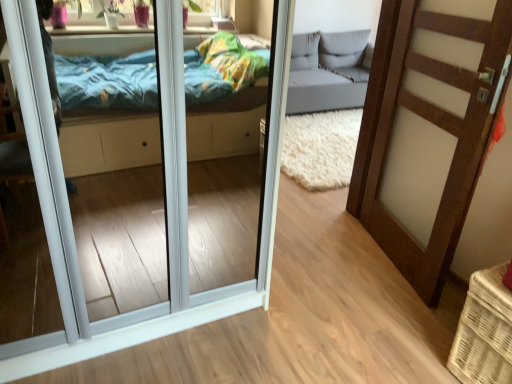
Question: Is brown wood door at right, placed as the 1th door when sorted from right to left, to the left or to the right of white wicker basket at lower right in the image?

Choices:
 (A) right
 (B) left

Answer: (B)

Question: Does point (430, 8) appear closer or farther from the camera than point (493, 332)?

Choices:
 (A) closer
 (B) farther

Answer: (B)

Question: Which of these objects is positioned farthest from the white glossy door at center, positioned as the 1th door in left-to-right order?

Choices:
 (A) white wicker basket at lower right
 (B) brown wood door at right, which is the 2th door from left to right

Answer: (A)

Question: Considering the real-world distances, which object is farthest from the white glossy door at center, positioned as the 1th door in left-to-right order?

Choices:
 (A) brown wood door at right, which is the 2th door from left to right
 (B) white wicker basket at lower right

Answer: (B)